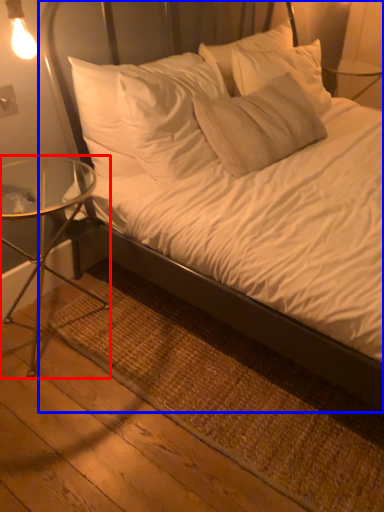
Question: Which object appears closest to the camera in this image, table (highlighted by a red box) or bed (highlighted by a blue box)?

Choices:
 (A) table
 (B) bed

Answer: (B)